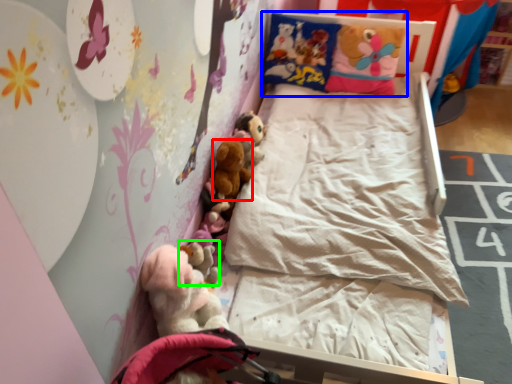
Question: Which is farther away from toy (highlighted by a red box)? pillow (highlighted by a blue box) or toy (highlighted by a green box)?

Choices:
 (A) pillow
 (B) toy

Answer: (A)